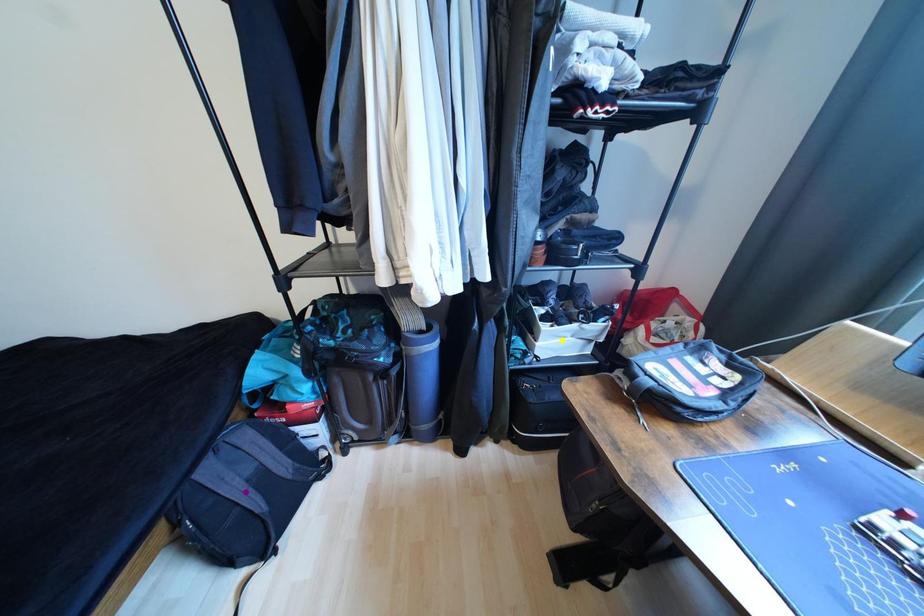
Order these from nearest to farthest:
green point
yellow point
purple point

green point
purple point
yellow point